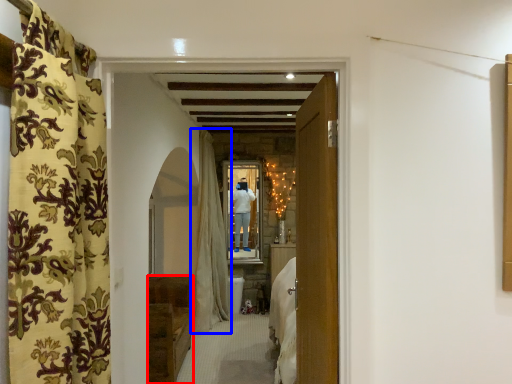
Question: Which point is closer to the camera, furniture (highlighted by a red box) or curtain (highlighted by a blue box)?

Choices:
 (A) furniture
 (B) curtain

Answer: (A)